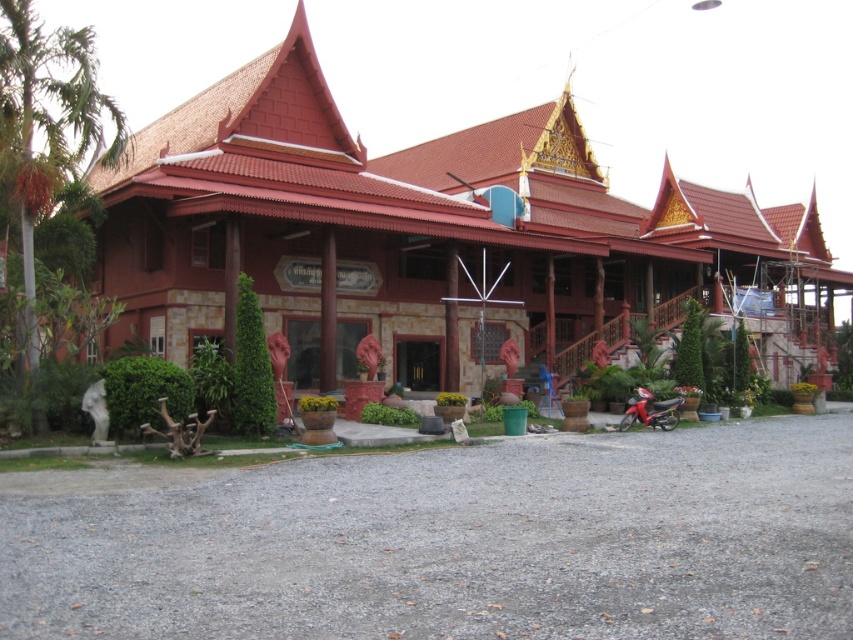
You are a visitor approaching the traditional building with a metallic red motorcycle at lower right and a green leafy palm tree at left. As you walk towards the entrance, which object will you encounter first?

The metallic red motorcycle at lower right will be encountered first because it is positioned lower and closer to the entrance compared to the green leafy palm tree at left, which is situated higher up.

You are standing at the entrance of the building and want to place a new decorative item. If you walk 0.150 meters to the right from the green leafy palm tree at left, where will you be in relation to the building?

If you walk 0.150 meters to the right from the green leafy palm tree at left, you will be 0.050 meters away from the building entrance because the palm tree is located at point 0.200 meters from the entrance. Subtracting the 0.150 meters walked to the right would place you at 0.050 meters from the entrance towards the left side.